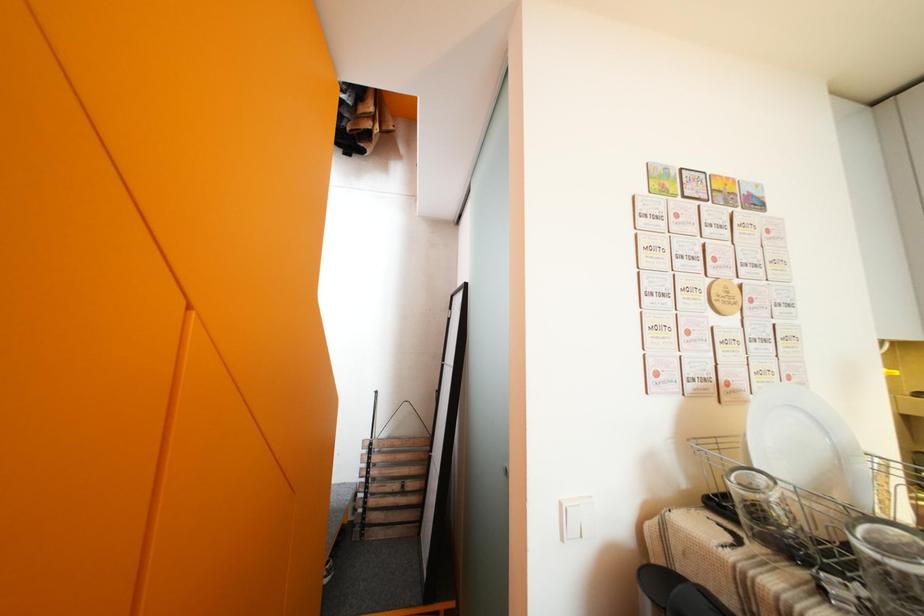
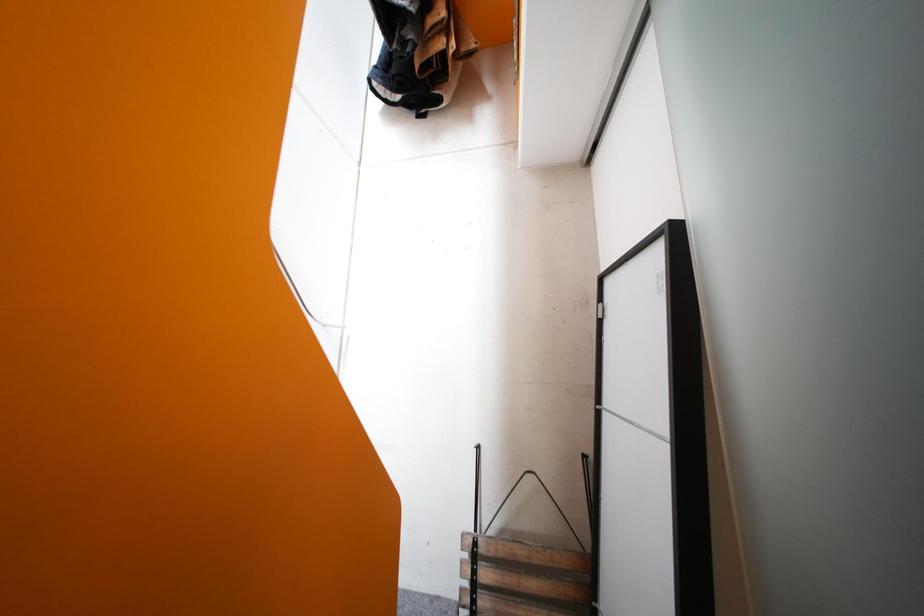
Question: In a continuous first-person perspective shot, in which direction is the camera moving?

Choices:
 (A) Left
 (B) Right
 (C) Forward
 (D) Backward

Answer: (C)